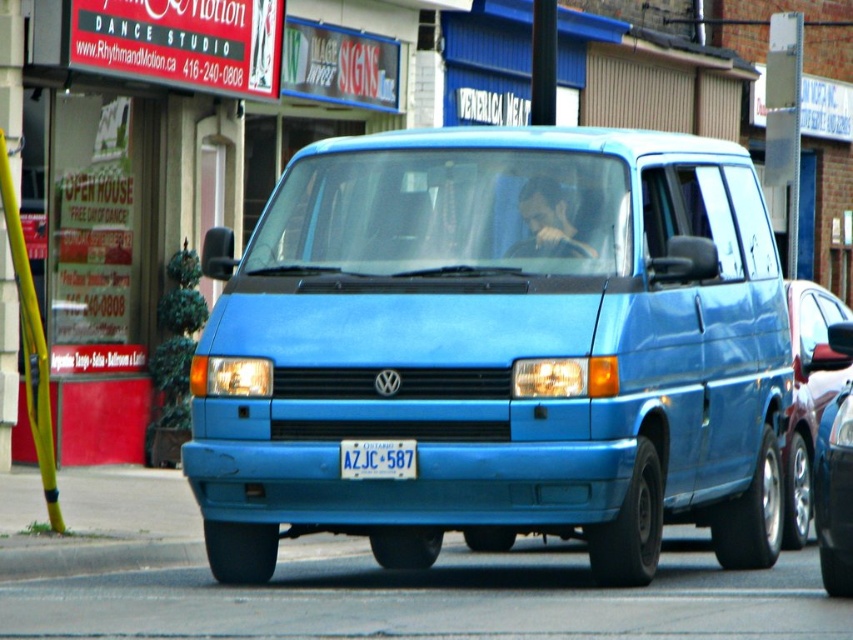
Where is `matte blue van at center`? The image size is (853, 640). matte blue van at center is located at coordinates (497, 348).

Who is positioned more to the right, matte blue van at center or white plastic license plate at center?

matte blue van at center is more to the right.

Who is more distant from viewer, (363, 516) or (345, 461)?

Point (363, 516)

The image size is (853, 640). In order to click on matte blue van at center in this screenshot , I will do `click(497, 348)`.

Is blue matte van at center shorter than white plastic license plate at center?

Incorrect, blue matte van at center's height does not fall short of white plastic license plate at center's.

You are a GUI agent. You are given a task and a screenshot of the screen. Output one action in this format:
    pyautogui.click(x=<x>, y=<y>)
    Task: Click on the blue matte van at center
    
    Given the screenshot: What is the action you would take?
    pyautogui.click(x=808, y=396)

This screenshot has height=640, width=853. What do you see at coordinates (808, 396) in the screenshot?
I see `blue matte van at center` at bounding box center [808, 396].

Find the location of a particular element. The image size is (853, 640). blue matte van at center is located at coordinates (808, 396).

Is matte blue van at center positioned before blue matte van at center?

Yes, matte blue van at center is closer to the viewer.

Which is below, matte blue van at center or blue matte van at center?

blue matte van at center is lower down.

Describe the element at coordinates (497, 348) in the screenshot. I see `matte blue van at center` at that location.

Where is `matte blue van at center`? matte blue van at center is located at coordinates (497, 348).